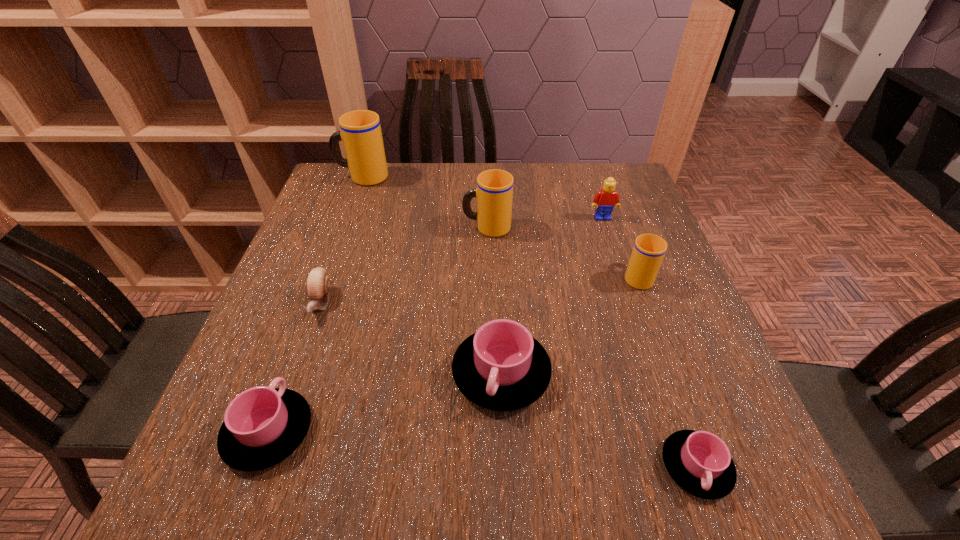
Select which pink cup is the second closest to the shortest cup. Please provide its 2D coordinates. Your answer should be formatted as a tuple, i.e. [(x, y)], where the tuple contains the x and y coordinates of a point satisfying the conditions above.

[(263, 425)]

You are a GUI agent. You are given a task and a screenshot of the screen. Output one action in this format:
    pyautogui.click(x=<x>, y=<y>)
    Task: Click on the free space that satisfies the following two spatial constraints: 1. on the side with the handle of the second shortest cup; 2. on the side of the second farthest cup with the handle
    Image resolution: width=960 pixels, height=540 pixels.
    Given the screenshot: What is the action you would take?
    pyautogui.click(x=343, y=227)